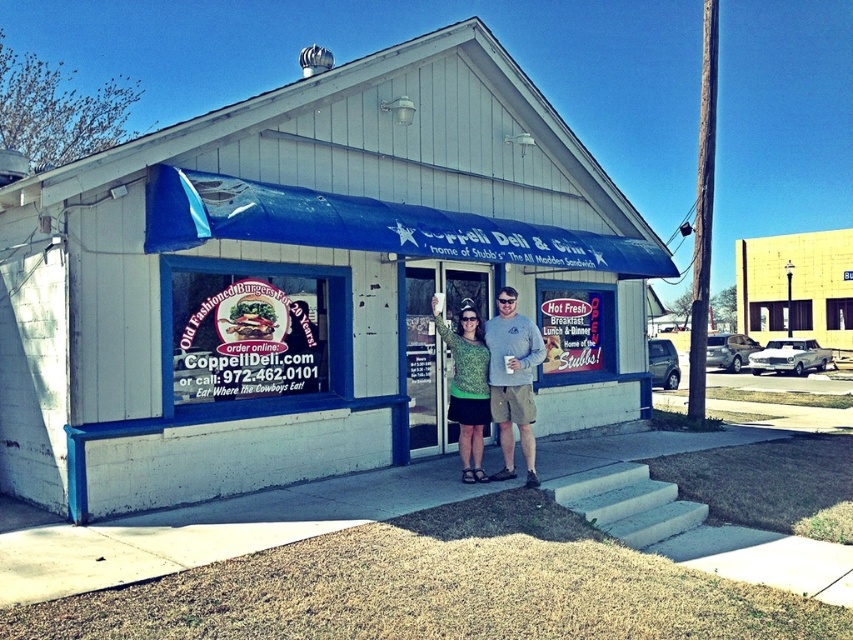
Can you confirm if blue fabric awning at center is taller than green textured sweater at center?

Incorrect, blue fabric awning at center's height is not larger of green textured sweater at center's.

Does blue fabric awning at center appear on the left side of green textured sweater at center?

Correct, you'll find blue fabric awning at center to the left of green textured sweater at center.

Who is more distant from viewer, (x=227, y=179) or (x=473, y=384)?

Positioned behind is point (x=473, y=384).

In order to click on blue fabric awning at center in this screenshot , I will do `click(372, 227)`.

This screenshot has height=640, width=853. What do you see at coordinates (306, 282) in the screenshot?
I see `white wood building at center` at bounding box center [306, 282].

Who is more forward, (473, 92) or (514, 292)?

Point (514, 292)

The width and height of the screenshot is (853, 640). In order to click on white wood building at center in this screenshot , I will do `click(306, 282)`.

Is blue fabric awning at center below green knit sweater at center?

Incorrect, blue fabric awning at center is not positioned below green knit sweater at center.

Which is behind, point (502, 244) or point (463, 371)?

The point (502, 244) is more distant.

Who is more forward, (462,252) or (480,476)?

Point (480,476)

Find the location of a particular element. blue fabric awning at center is located at coordinates (372, 227).